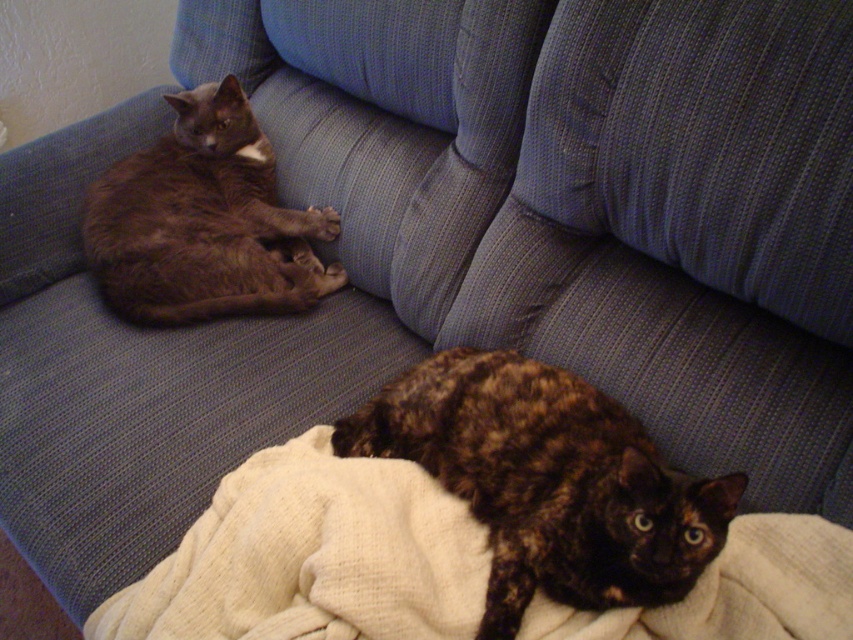
You are a photographer positioned at the center of the room. You want to focus your camera on the blue textured cushion at upper right. Based on the coordinates provided in the description, is the cushion closer to the left or right side of the image?

The blue textured cushion at upper right is located at point 0.223 on the x and 0.828 on the y. Since the x coordinate is 0.223, which is closer to 0, the cushion is closer to the left side of the image.

You are a cat owner trying to place a new toy on the blue textured cushion at upper right. Can you tell me if the tortoiseshell fur cat at lower center is under the cushion?

The blue textured cushion at upper right is above the tortoiseshell fur cat at lower center, so yes, the tortoiseshell fur cat at lower center is under the cushion.

You are a cat owner who wants to place a 30 inch long cat toy on the blue textured cushion at upper right. Can the cat toy fit on the cushion?

The blue textured cushion at upper right is 34.50 inches from viewer, so the cat toy which is 30 inches long can fit on the cushion as it is shorter than the cushion length.